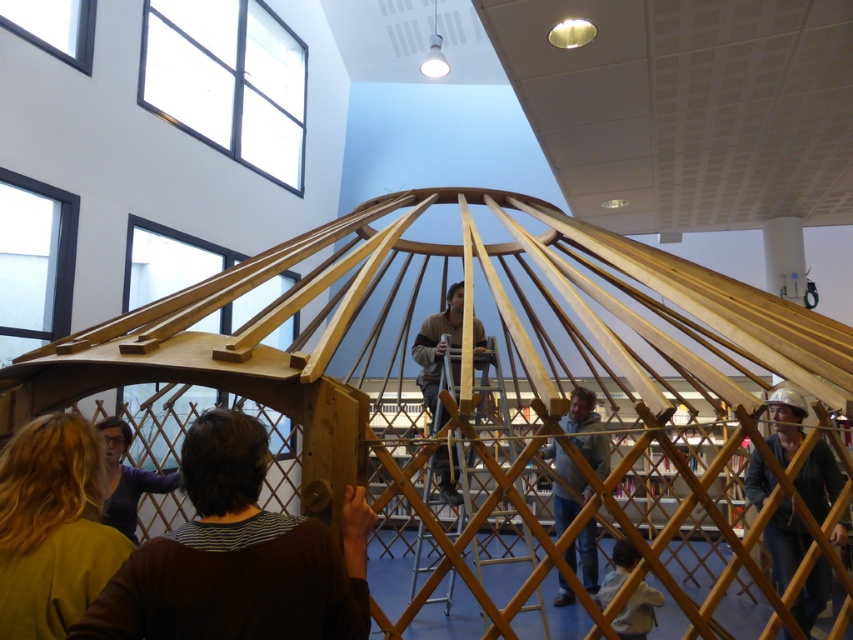
Question: Is blonde hair at lower left smaller than wooden helmet at right?

Choices:
 (A) no
 (B) yes

Answer: (B)

Question: Which object is closer to the camera taking this photo?

Choices:
 (A) matte purple sweater at lower left
 (B) wooden ladder at center

Answer: (A)

Question: Is light blue hoodie at center bigger than light brown wooden frame at lower center?

Choices:
 (A) no
 (B) yes

Answer: (B)

Question: Does wooden helmet at right appear over light brown wooden frame at lower center?

Choices:
 (A) no
 (B) yes

Answer: (B)

Question: Which point is closer to the camera?

Choices:
 (A) blonde hair at lower left
 (B) light brown wooden frame at lower center
 (C) wooden helmet at right
 (D) light blue hoodie at center

Answer: (A)

Question: Based on their relative distances, which object is farther from the light brown wooden frame at lower center?

Choices:
 (A) matte purple sweater at lower left
 (B) light blue hoodie at center

Answer: (A)